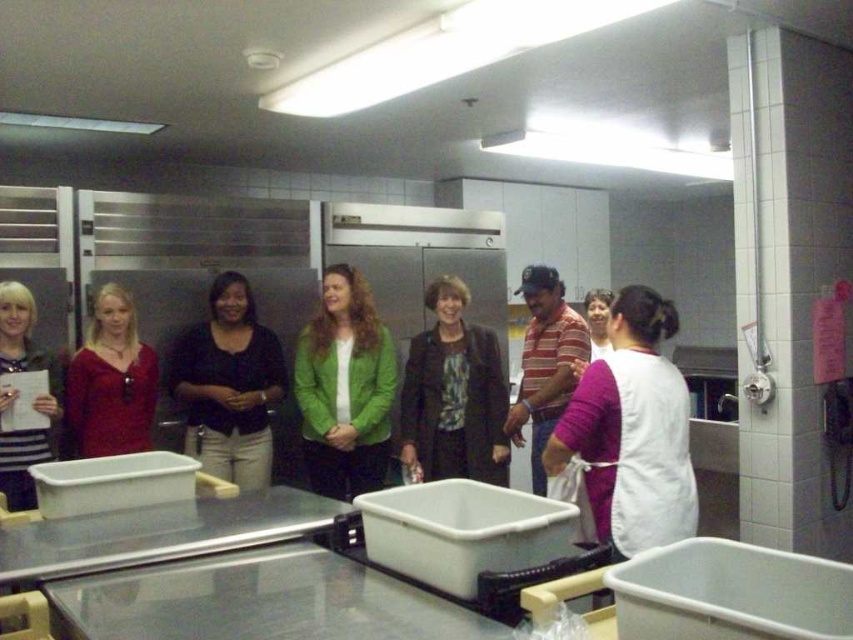
Question: Can you confirm if matte black jacket at center is positioned below matte black shirt at left?

Choices:
 (A) no
 (B) yes

Answer: (B)

Question: Which is farther from the matte black shirt at left?

Choices:
 (A) matte black jacket at center
 (B) matte black shirt at center

Answer: (A)

Question: Does matte black jacket at center have a lesser width compared to matte red sweater at center?

Choices:
 (A) no
 (B) yes

Answer: (A)

Question: Which point is farther to the camera?

Choices:
 (A) matte black shirt at left
 (B) matte red sweater at center
 (C) matte black jacket at center

Answer: (C)

Question: Can you confirm if matte black jacket at center is positioned to the left of matte black shirt at center?

Choices:
 (A) yes
 (B) no

Answer: (B)

Question: Which point is farther to the camera?

Choices:
 (A) (103, 342)
 (B) (347, 324)
 (C) (422, 474)
 (D) (0, 456)

Answer: (B)